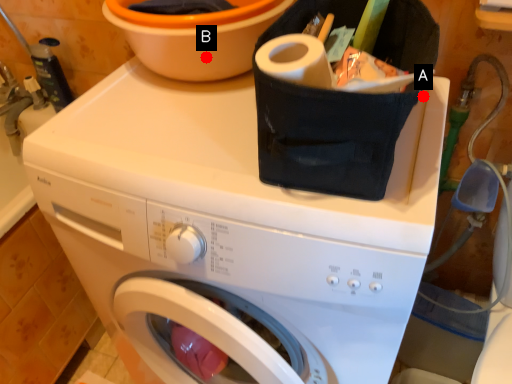
Question: Two points are circled on the image, labeled by A and B beside each circle. Among these points, which one is nearest to the camera?

Choices:
 (A) A is closer
 (B) B is closer

Answer: (A)